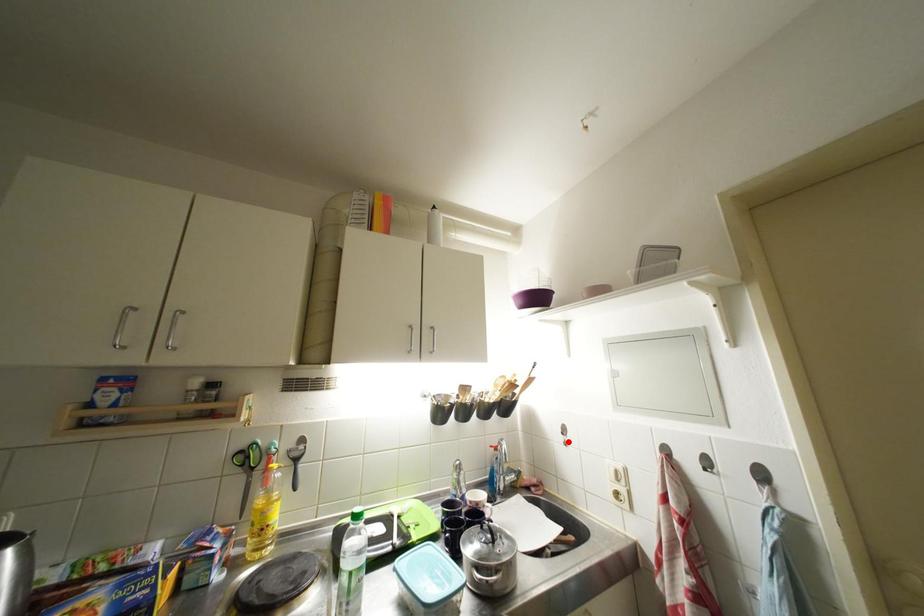
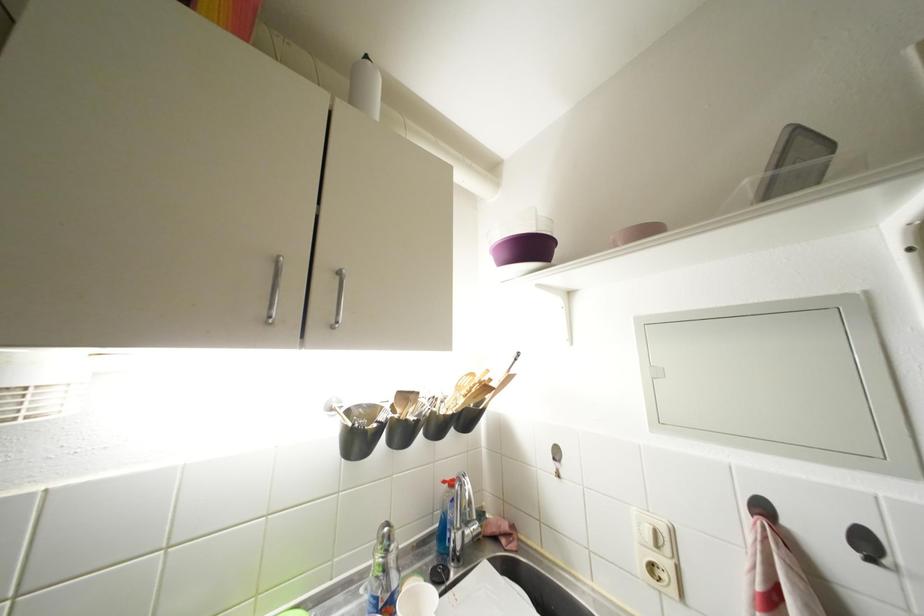
In the second image, find the point that corresponds to the highlighted location in the first image.

(560, 469)